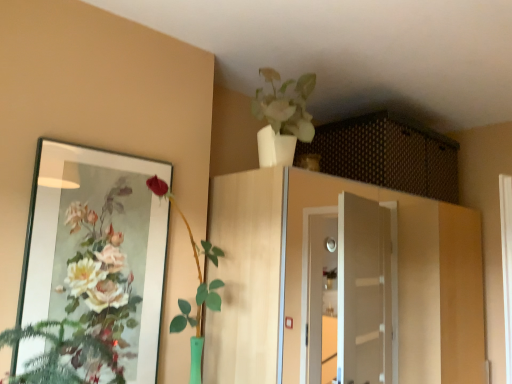
What do you see at coordinates (282, 118) in the screenshot? The height and width of the screenshot is (384, 512). I see `white glossy vase at upper center, which is the 1th houseplant in top-to-bottom order` at bounding box center [282, 118].

Identify the location of brown woven basket at upper center, acting as the first cabinetry starting from the top. This screenshot has width=512, height=384. point(387,155).

In order to face matte glass mirror at left, should I rotate leftwards or rightwards?

You should rotate left by 19.438 degrees.

What are the coordinates of `green glass vase at left, which is counted as the second houseplant, starting from the right` in the screenshot? It's located at (198, 286).

Considering the relative positions of matte glass mirror at left and white glossy vase at upper center, which is the 2th houseplant in left-to-right order, in the image provided, is matte glass mirror at left to the left of white glossy vase at upper center, which is the 2th houseplant in left-to-right order, from the viewer's perspective?

Correct, you'll find matte glass mirror at left to the left of white glossy vase at upper center, which is the 2th houseplant in left-to-right order.

From a real-world perspective, is matte glass mirror at left positioned over white glossy vase at upper center, which is the 1th houseplant in top-to-bottom order, based on gravity?

No, from a real-world perspective, matte glass mirror at left is not above white glossy vase at upper center, which is the 1th houseplant in top-to-bottom order.

Is matte glass mirror at left aimed at white glossy vase at upper center, which is the 1th houseplant in top-to-bottom order?

No.

Considering the sizes of objects matte glass mirror at left and white glossy vase at upper center, which is the 2th houseplant in left-to-right order, in the image provided, who is wider, matte glass mirror at left or white glossy vase at upper center, which is the 2th houseplant in left-to-right order,?

Wider between the two is white glossy vase at upper center, which is the 2th houseplant in left-to-right order.

Looking at this image, between wooden cabinet at center, acting as the 2th cabinetry starting from the top, and white glossy vase at upper center, which is the 1th houseplant in top-to-bottom order, which one has larger width?

With larger width is wooden cabinet at center, acting as the 2th cabinetry starting from the top.

Considering the positions of objects wooden cabinet at center, positioned as the 1th cabinetry in bottom-to-top order, and white glossy vase at upper center, which is the 2th houseplant in left-to-right order, in the image provided, who is more to the right, wooden cabinet at center, positioned as the 1th cabinetry in bottom-to-top order, or white glossy vase at upper center, which is the 2th houseplant in left-to-right order,?

wooden cabinet at center, positioned as the 1th cabinetry in bottom-to-top order.

Starting from the wooden cabinet at center, acting as the 2th cabinetry starting from the top, which houseplant is the 1st one to the left? Please provide its 2D coordinates.

[(282, 118)]

Does point (456, 230) come in front of point (262, 118)?

No, (456, 230) is behind (262, 118).

Considering the sizes of white glossy vase at upper center, which is the 1th houseplant in top-to-bottom order, and matte glass mirror at left in the image, is white glossy vase at upper center, which is the 1th houseplant in top-to-bottom order, taller or shorter than matte glass mirror at left?

Considering their sizes, white glossy vase at upper center, which is the 1th houseplant in top-to-bottom order, has less height than matte glass mirror at left.

Could you tell me if white glossy vase at upper center, which is counted as the 2th houseplant, starting from the bottom, is facing matte glass mirror at left?

No, white glossy vase at upper center, which is counted as the 2th houseplant, starting from the bottom, is not facing towards matte glass mirror at left.

Based on the photo, is the depth of white glossy vase at upper center, which is counted as the 2th houseplant, starting from the bottom, less than that of matte glass mirror at left?

No, white glossy vase at upper center, which is counted as the 2th houseplant, starting from the bottom, is behind matte glass mirror at left.

Between point (56, 217) and point (178, 320), which one is positioned in front?

The point (56, 217) is in front.

From a real-world perspective, is matte glass mirror at left on green glass vase at left, the first houseplant from the bottom?

Yes.

Which object is positioned more to the right, matte glass mirror at left or green glass vase at left, the first houseplant from the bottom?

green glass vase at left, the first houseplant from the bottom, is more to the right.

Can you confirm if matte glass mirror at left is smaller than green glass vase at left, the 2th houseplant from the top?

Yes.

From the image's perspective, is white glossy vase at upper center, which is the 1th houseplant in top-to-bottom order, on brown woven basket at upper center, the 2th cabinetry in the bottom-to-top sequence?

Yes.

Which is correct: white glossy vase at upper center, the 1th houseplant positioned from the right, is inside brown woven basket at upper center, the 2th cabinetry in the bottom-to-top sequence, or outside of it?

white glossy vase at upper center, the 1th houseplant positioned from the right, is not inside brown woven basket at upper center, the 2th cabinetry in the bottom-to-top sequence, it's outside.

Considering the positions of objects white glossy vase at upper center, which is the 1th houseplant in top-to-bottom order, and brown woven basket at upper center, the 2th cabinetry in the bottom-to-top sequence, in the image provided, who is more to the left, white glossy vase at upper center, which is the 1th houseplant in top-to-bottom order, or brown woven basket at upper center, the 2th cabinetry in the bottom-to-top sequence,?

white glossy vase at upper center, which is the 1th houseplant in top-to-bottom order, is more to the left.

Is white glossy vase at upper center, which is counted as the 2th houseplant, starting from the bottom, facing away from brown woven basket at upper center, acting as the first cabinetry starting from the top?

No, white glossy vase at upper center, which is counted as the 2th houseplant, starting from the bottom, is not facing away from brown woven basket at upper center, acting as the first cabinetry starting from the top.

Is green glass vase at left, the first houseplant from the bottom, not close to wooden cabinet at center, positioned as the 1th cabinetry in bottom-to-top order?

Yes, green glass vase at left, the first houseplant from the bottom, and wooden cabinet at center, positioned as the 1th cabinetry in bottom-to-top order, are quite far apart.

In the scene shown: Can you confirm if green glass vase at left, the first houseplant from the bottom, is positioned to the right of wooden cabinet at center, acting as the 2th cabinetry starting from the top?

No, green glass vase at left, the first houseplant from the bottom, is not to the right of wooden cabinet at center, acting as the 2th cabinetry starting from the top.

Is green glass vase at left, which is the 1th houseplant in left-to-right order, completely or partially outside of wooden cabinet at center, positioned as the 1th cabinetry in bottom-to-top order?

green glass vase at left, which is the 1th houseplant in left-to-right order, lies outside wooden cabinet at center, positioned as the 1th cabinetry in bottom-to-top order,'s area.

From the image's perspective, is green glass vase at left, which is counted as the second houseplant, starting from the right, below wooden cabinet at center, acting as the 2th cabinetry starting from the top?

No, from the image's perspective, green glass vase at left, which is counted as the second houseplant, starting from the right, is not beneath wooden cabinet at center, acting as the 2th cabinetry starting from the top.

From the image's perspective, is white glossy vase at upper center, which is the 1th houseplant in top-to-bottom order, above or below wooden cabinet at center, positioned as the 1th cabinetry in bottom-to-top order?

From the image's perspective, white glossy vase at upper center, which is the 1th houseplant in top-to-bottom order, appears above wooden cabinet at center, positioned as the 1th cabinetry in bottom-to-top order.

Who is shorter, white glossy vase at upper center, which is the 1th houseplant in top-to-bottom order, or wooden cabinet at center, acting as the 2th cabinetry starting from the top?

white glossy vase at upper center, which is the 1th houseplant in top-to-bottom order, is shorter.

Is wooden cabinet at center, acting as the 2th cabinetry starting from the top, a part of white glossy vase at upper center, the 1th houseplant positioned from the right?

No, wooden cabinet at center, acting as the 2th cabinetry starting from the top, is located outside of white glossy vase at upper center, the 1th houseplant positioned from the right.

Can you confirm if white glossy vase at upper center, which is counted as the 2th houseplant, starting from the bottom, is positioned to the left of wooden cabinet at center, positioned as the 1th cabinetry in bottom-to-top order?

Indeed, white glossy vase at upper center, which is counted as the 2th houseplant, starting from the bottom, is positioned on the left side of wooden cabinet at center, positioned as the 1th cabinetry in bottom-to-top order.

At what (x,y) coordinates should I click in order to perform the action: click on mirror beneath the white glossy vase at upper center, which is counted as the 2th houseplant, starting from the bottom (from a real-world perspective). Please return your answer as a coordinate pair (x, y). The image size is (512, 384). Looking at the image, I should click on pos(97,248).

Image resolution: width=512 pixels, height=384 pixels. In order to click on the 2nd cabinetry below the white glossy vase at upper center, the 1th houseplant positioned from the right (from the image's perspective) in this screenshot , I will do `click(305, 275)`.

Looking at this image, estimate the real-world distances between objects in this image. Which object is closer to brown woven basket at upper center, the 2th cabinetry in the bottom-to-top sequence, green glass vase at left, which is counted as the second houseplant, starting from the right, or matte glass mirror at left?

Based on the image, green glass vase at left, which is counted as the second houseplant, starting from the right, appears to be nearer to brown woven basket at upper center, the 2th cabinetry in the bottom-to-top sequence.

Based on their spatial positions, is brown woven basket at upper center, the 2th cabinetry in the bottom-to-top sequence, or green glass vase at left, which is counted as the second houseplant, starting from the right, closer to matte glass mirror at left?

Based on the image, green glass vase at left, which is counted as the second houseplant, starting from the right, appears to be nearer to matte glass mirror at left.

Which object lies nearer to the anchor point white glossy vase at upper center, which is the 1th houseplant in top-to-bottom order, brown woven basket at upper center, acting as the first cabinetry starting from the top, or wooden cabinet at center, positioned as the 1th cabinetry in bottom-to-top order?

brown woven basket at upper center, acting as the first cabinetry starting from the top.

Looking at the image, which one is located closer to matte glass mirror at left, white glossy vase at upper center, which is the 2th houseplant in left-to-right order, or green glass vase at left, the 2th houseplant from the top?

green glass vase at left, the 2th houseplant from the top.

Which object lies further to the anchor point green glass vase at left, the 2th houseplant from the top, wooden cabinet at center, acting as the 2th cabinetry starting from the top, or brown woven basket at upper center, the 2th cabinetry in the bottom-to-top sequence?

The object further to green glass vase at left, the 2th houseplant from the top, is wooden cabinet at center, acting as the 2th cabinetry starting from the top.

When comparing their distances from brown woven basket at upper center, acting as the first cabinetry starting from the top, does wooden cabinet at center, acting as the 2th cabinetry starting from the top, or white glossy vase at upper center, the 1th houseplant positioned from the right, seem further?

Among the two, white glossy vase at upper center, the 1th houseplant positioned from the right, is located further to brown woven basket at upper center, acting as the first cabinetry starting from the top.

Considering their positions, is white glossy vase at upper center, which is counted as the 2th houseplant, starting from the bottom, positioned further to green glass vase at left, which is the 1th houseplant in left-to-right order, than brown woven basket at upper center, the 2th cabinetry in the bottom-to-top sequence?

Among the two, brown woven basket at upper center, the 2th cabinetry in the bottom-to-top sequence, is located further to green glass vase at left, which is the 1th houseplant in left-to-right order.

Which object lies nearer to the anchor point brown woven basket at upper center, the 2th cabinetry in the bottom-to-top sequence, matte glass mirror at left or white glossy vase at upper center, which is the 2th houseplant in left-to-right order?

white glossy vase at upper center, which is the 2th houseplant in left-to-right order, lies closer to brown woven basket at upper center, the 2th cabinetry in the bottom-to-top sequence, than the other object.

This screenshot has height=384, width=512. What are the coordinates of `houseplant between white glossy vase at upper center, the 1th houseplant positioned from the right, and wooden cabinet at center, positioned as the 1th cabinetry in bottom-to-top order, in the vertical direction` in the screenshot? It's located at (198, 286).

Find the location of a particular element. The width and height of the screenshot is (512, 384). cabinetry between white glossy vase at upper center, which is the 1th houseplant in top-to-bottom order, and wooden cabinet at center, acting as the 2th cabinetry starting from the top, vertically is located at coordinates (387, 155).

You are a GUI agent. You are given a task and a screenshot of the screen. Output one action in this format:
    pyautogui.click(x=<x>, y=<y>)
    Task: Click on the houseplant located between green glass vase at left, which is counted as the second houseplant, starting from the right, and brown woven basket at upper center, acting as the first cabinetry starting from the top, in the left-right direction
    The height and width of the screenshot is (384, 512).
    Given the screenshot: What is the action you would take?
    pyautogui.click(x=282, y=118)

Identify the location of cabinetry between green glass vase at left, which is the 1th houseplant in left-to-right order, and brown woven basket at upper center, the 2th cabinetry in the bottom-to-top sequence. (305, 275).